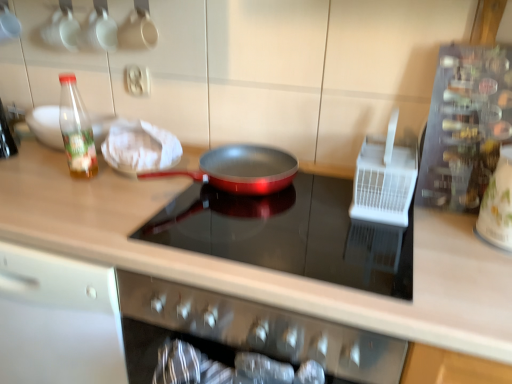
Question: From a real-world perspective, is white cloth at upper left physically below white glossy jar at right, the 3th appliance positioned from the left?

Choices:
 (A) no
 (B) yes

Answer: (B)

Question: Considering the relative sizes of white cloth at upper left and white glossy jar at right, the 3th appliance positioned from the left, in the image provided, is white cloth at upper left taller than white glossy jar at right, the 3th appliance positioned from the left,?

Choices:
 (A) no
 (B) yes

Answer: (A)

Question: From a real-world perspective, is white cloth at upper left positioned over white glossy jar at right, arranged as the first appliance when viewed from the right, based on gravity?

Choices:
 (A) yes
 (B) no

Answer: (B)

Question: Is white cloth at upper left outside white glossy jar at right, arranged as the first appliance when viewed from the right?

Choices:
 (A) no
 (B) yes

Answer: (B)

Question: Is white cloth at upper left shorter than white glossy jar at right, arranged as the first appliance when viewed from the right?

Choices:
 (A) no
 (B) yes

Answer: (B)

Question: Does white cloth at upper left have a larger size compared to white glossy jar at right, arranged as the first appliance when viewed from the right?

Choices:
 (A) yes
 (B) no

Answer: (B)

Question: From the image's perspective, is metallic silver spice rack at right, which ranks as the 2th appliance in right-to-left order, located beneath matte wood countertop at center?

Choices:
 (A) no
 (B) yes

Answer: (A)

Question: Is metallic silver spice rack at right, placed as the second appliance when sorted from left to right, located outside matte wood countertop at center?

Choices:
 (A) no
 (B) yes

Answer: (B)

Question: Is metallic silver spice rack at right, which ranks as the 2th appliance in right-to-left order, further to camera compared to matte wood countertop at center?

Choices:
 (A) no
 (B) yes

Answer: (B)

Question: Could you tell me if metallic silver spice rack at right, which ranks as the 2th appliance in right-to-left order, is facing matte wood countertop at center?

Choices:
 (A) no
 (B) yes

Answer: (A)

Question: Considering the relative sizes of metallic silver spice rack at right, placed as the second appliance when sorted from left to right, and matte wood countertop at center in the image provided, is metallic silver spice rack at right, placed as the second appliance when sorted from left to right, taller than matte wood countertop at center?

Choices:
 (A) no
 (B) yes

Answer: (A)

Question: Considering the relative sizes of metallic silver spice rack at right, placed as the second appliance when sorted from left to right, and matte wood countertop at center in the image provided, is metallic silver spice rack at right, placed as the second appliance when sorted from left to right, thinner than matte wood countertop at center?

Choices:
 (A) no
 (B) yes

Answer: (B)

Question: Is white plastic utensil holder at right, which is the 1th appliance from left to right, positioned with its back to white glossy jar at right, arranged as the first appliance when viewed from the right?

Choices:
 (A) no
 (B) yes

Answer: (A)